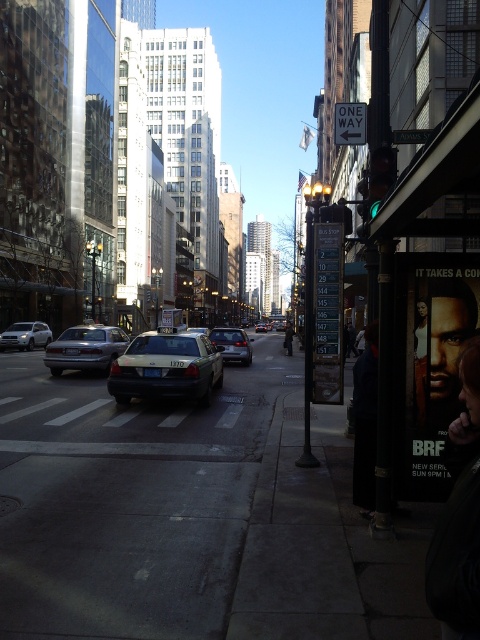
Can you confirm if gray asphalt at center is positioned to the left of dark blue jeans at center?

Yes, gray asphalt at center is to the left of dark blue jeans at center.

Find the location of a particular element. Image resolution: width=480 pixels, height=640 pixels. gray asphalt at center is located at coordinates (128, 500).

Who is more distant from viewer, (66, 380) or (288, 323)?

The point (288, 323) is behind.

Where is `gray asphalt at center`? The height and width of the screenshot is (640, 480). gray asphalt at center is located at coordinates (128, 500).

Does smooth skin face at lower right appear over metallic silver street sign at upper center?

No, smooth skin face at lower right is not above metallic silver street sign at upper center.

Measure the distance between smooth skin face at lower right and metallic silver street sign at upper center.

smooth skin face at lower right is 8.50 meters from metallic silver street sign at upper center.

Does point (452, 465) come behind point (414, 134)?

No, (452, 465) is closer to viewer.

Locate an element on the screen. smooth skin face at lower right is located at coordinates (458, 516).

How far apart are gray asphalt at center and smooth skin face at lower right?

gray asphalt at center is 24.95 feet from smooth skin face at lower right.

Which of these two, gray asphalt at center or smooth skin face at lower right, stands shorter?

With less height is gray asphalt at center.

Describe the element at coordinates (128, 500) in the screenshot. I see `gray asphalt at center` at that location.

What are the coordinates of `gray asphalt at center` in the screenshot? It's located at (128, 500).